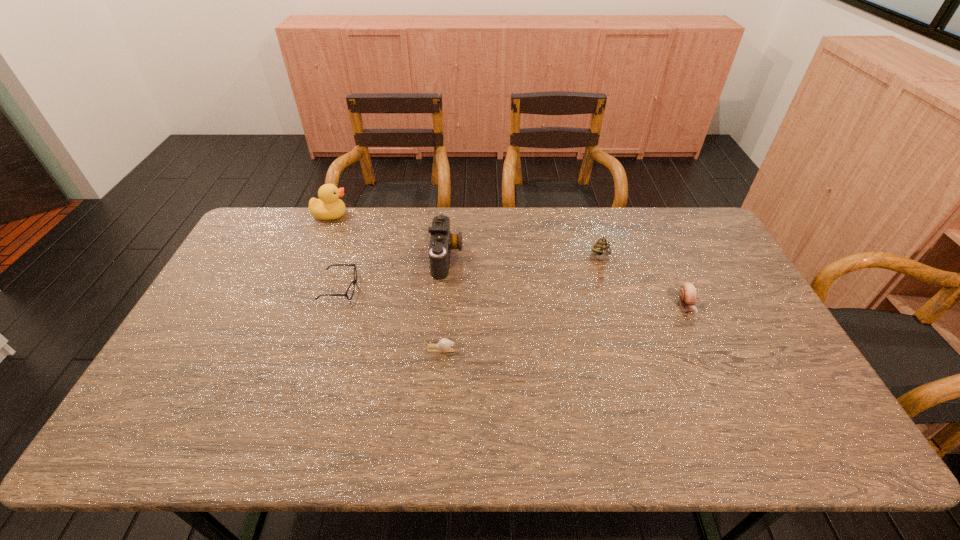
At what (x,y) coordinates should I click in order to perform the action: click on vacant position located on the face of the farthest escargot. Please return your answer as a coordinate pair (x, y). This screenshot has height=540, width=960. Looking at the image, I should click on (609, 282).

Where is `free region located on the lens of the camera`? This screenshot has width=960, height=540. free region located on the lens of the camera is located at coordinates (498, 257).

This screenshot has width=960, height=540. In order to click on free location located 0.290m on the front-facing side of the second shortest escargot in this screenshot , I will do `click(734, 413)`.

Identify the location of vacant region located 0.310m on the front-facing side of the spectacles. (458, 288).

Find the location of a particular element. This screenshot has height=540, width=960. vacant area situated on the shell of the nearest object is located at coordinates click(477, 349).

I want to click on duck positioned at the far edge, so click(x=328, y=207).

Find the location of a particular element. This screenshot has width=960, height=540. snail at the far edge is located at coordinates (602, 248).

What are the coordinates of `camera at the far edge` in the screenshot? It's located at (442, 241).

Locate an element on the screen. The image size is (960, 540). vacant space at the far edge of the desktop is located at coordinates coord(353,219).

Locate an element on the screen. free space at the near edge of the desktop is located at coordinates (479, 426).